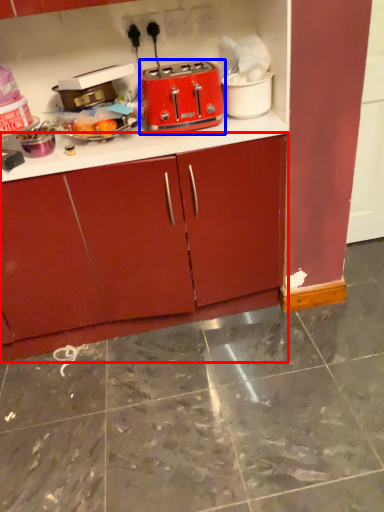
Question: Which of the following is the farthest to the observer, cabinetry (highlighted by a red box) or toaster (highlighted by a blue box)?

Choices:
 (A) cabinetry
 (B) toaster

Answer: (B)